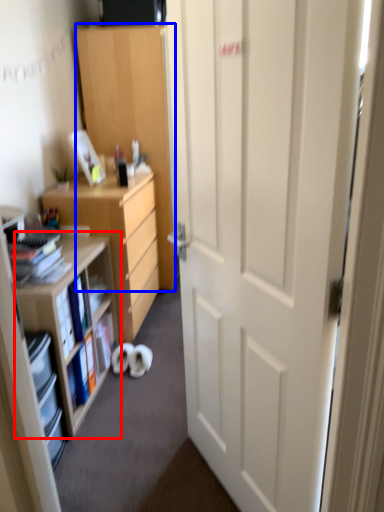
Question: Which point is further to the camera, shelf (highlighted by a red box) or cabinetry (highlighted by a blue box)?

Choices:
 (A) shelf
 (B) cabinetry

Answer: (B)